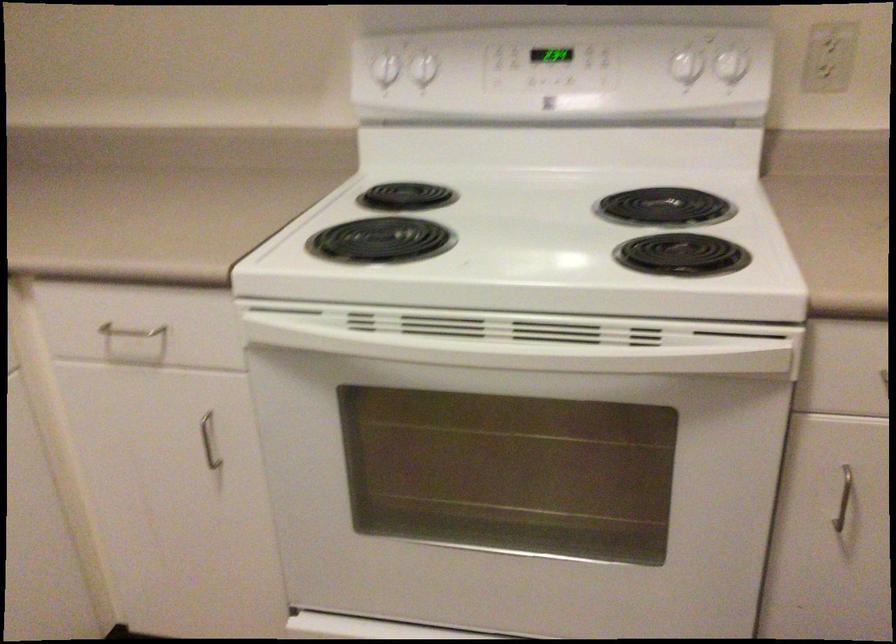
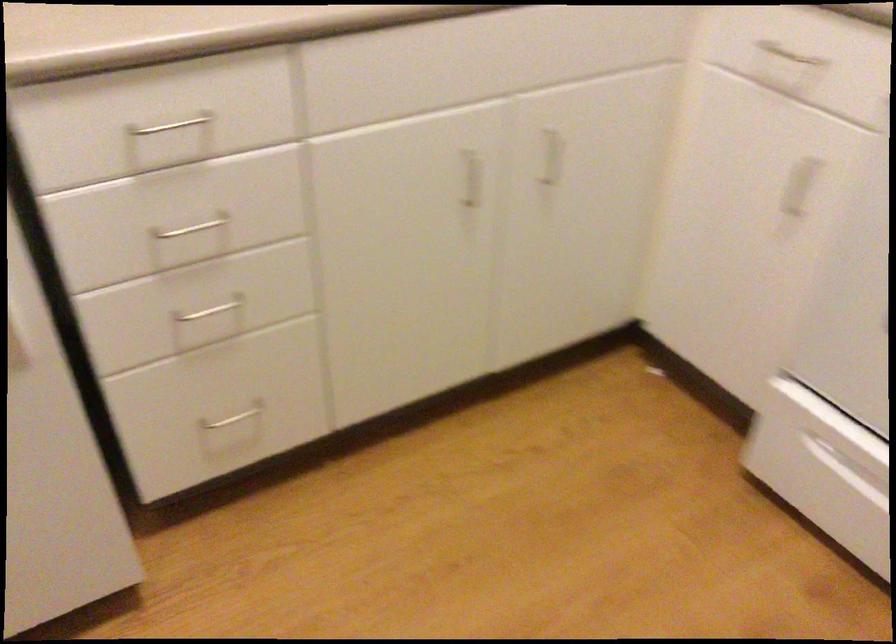
The images are taken continuously from a first-person perspective. In which direction is your viewpoint rotating?

The camera's rotation is toward left-down.